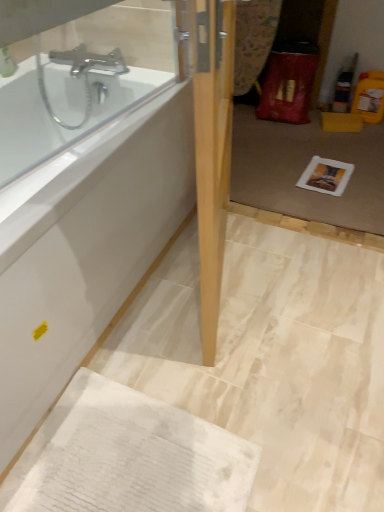
Question: Looking at the image, does white glossy bathtub at upper left seem bigger or smaller compared to white textured towel at lower left?

Choices:
 (A) big
 (B) small

Answer: (A)

Question: Does point (0, 322) appear closer or farther from the camera than point (96, 392)?

Choices:
 (A) farther
 (B) closer

Answer: (B)

Question: Which object is positioned closest to the light wood door at center?

Choices:
 (A) white glossy bathtub at upper left
 (B) white paper at center
 (C) transparent glass door at center
 (D) white textured towel at lower left

Answer: (A)

Question: Which object is the closest to the light wood door at center?

Choices:
 (A) transparent glass door at center
 (B) white glossy bathtub at upper left
 (C) white textured towel at lower left
 (D) white paper at center

Answer: (B)